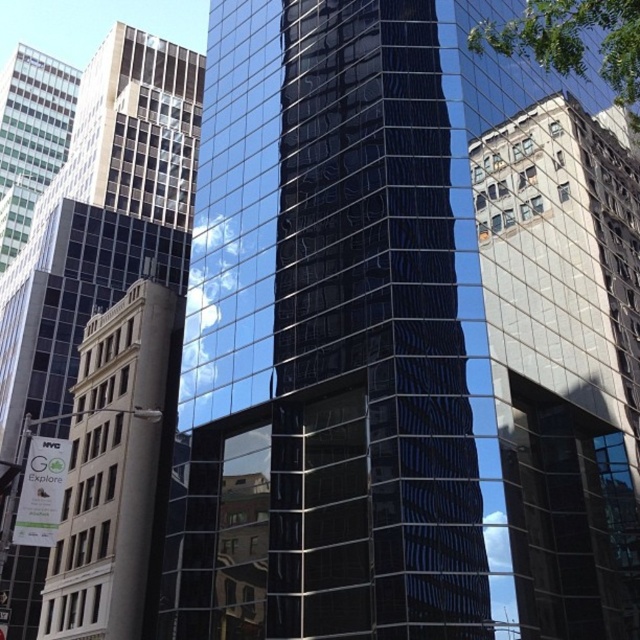
Question: Can you confirm if glossy glass tower at center is bigger than white stone tower at left?

Choices:
 (A) no
 (B) yes

Answer: (B)

Question: Based on their relative distances, which object is farther from the matte glass skyscraper at upper left?

Choices:
 (A) reflective glass building at center
 (B) glossy glass tower at center
 (C) white stone tower at left

Answer: (A)

Question: Which point is closer to the camera taking this photo?

Choices:
 (A) (200, 394)
 (B) (161, 566)
 (C) (176, 65)
 (D) (566, 120)

Answer: (A)

Question: Does reflective glass building at center have a lesser width compared to white stone tower at left?

Choices:
 (A) yes
 (B) no

Answer: (B)

Question: Can you confirm if glossy glass tower at center is bigger than reflective glass building at center?

Choices:
 (A) no
 (B) yes

Answer: (B)

Question: Which of the following is the closest to the observer?

Choices:
 (A) reflective glass building at center
 (B) white stone tower at left
 (C) glossy glass tower at center

Answer: (C)